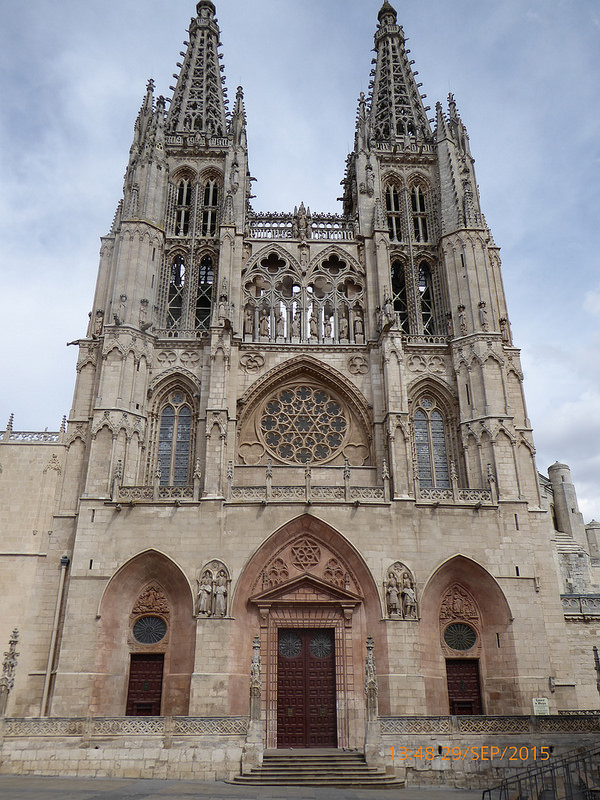
This screenshot has width=600, height=800. What are the coordinates of `window` in the screenshot? It's located at (183, 446), (167, 437), (177, 397), (426, 402), (439, 440), (425, 450), (303, 424).